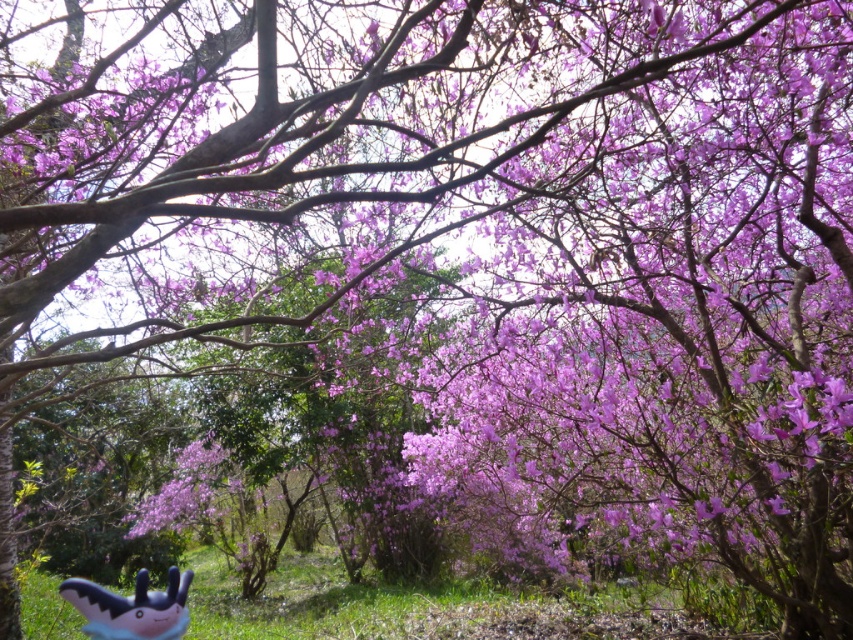
Does matte purple flower at center have a lesser width compared to plush toy at lower left?

Incorrect, matte purple flower at center's width is not less than plush toy at lower left's.

Does matte purple flower at center have a smaller size compared to plush toy at lower left?

Actually, matte purple flower at center might be larger than plush toy at lower left.

In the scene shown: Who is more distant from viewer, (218, 481) or (125, 608)?

The point (218, 481) is behind.

Find the location of a particular element. Image resolution: width=853 pixels, height=640 pixels. matte purple flower at center is located at coordinates (189, 492).